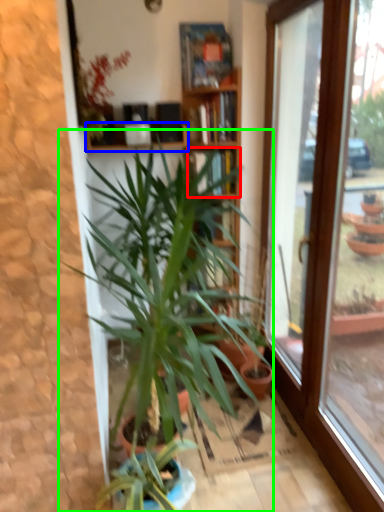
Question: Which object is the farthest from shelf (highlighted by a red box)? Choose among these: shelf (highlighted by a blue box) or houseplant (highlighted by a green box).

Choices:
 (A) shelf
 (B) houseplant

Answer: (B)